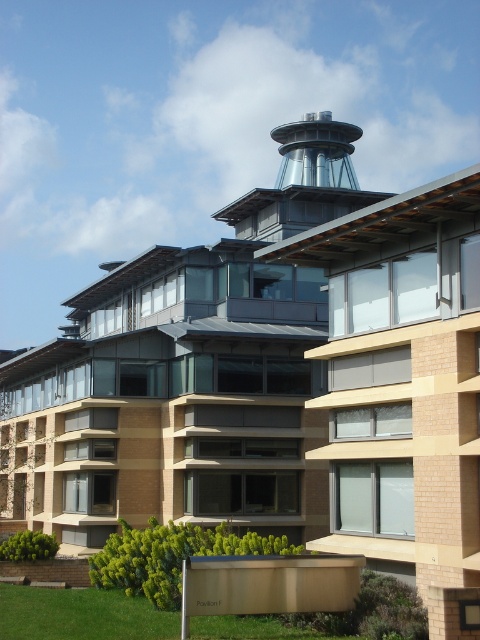
Question: Can you confirm if metallic glass control tower at upper center is positioned to the left of sleek metallic control tower at upper center?

Choices:
 (A) yes
 (B) no

Answer: (A)

Question: Can you confirm if metallic glass control tower at upper center is thinner than sleek metallic control tower at upper center?

Choices:
 (A) no
 (B) yes

Answer: (B)

Question: Which of the following is the farthest from the observer?

Choices:
 (A) (330, 118)
 (B) (315, 156)

Answer: (A)

Question: Does metallic glass control tower at upper center have a smaller size compared to sleek metallic control tower at upper center?

Choices:
 (A) yes
 (B) no

Answer: (A)